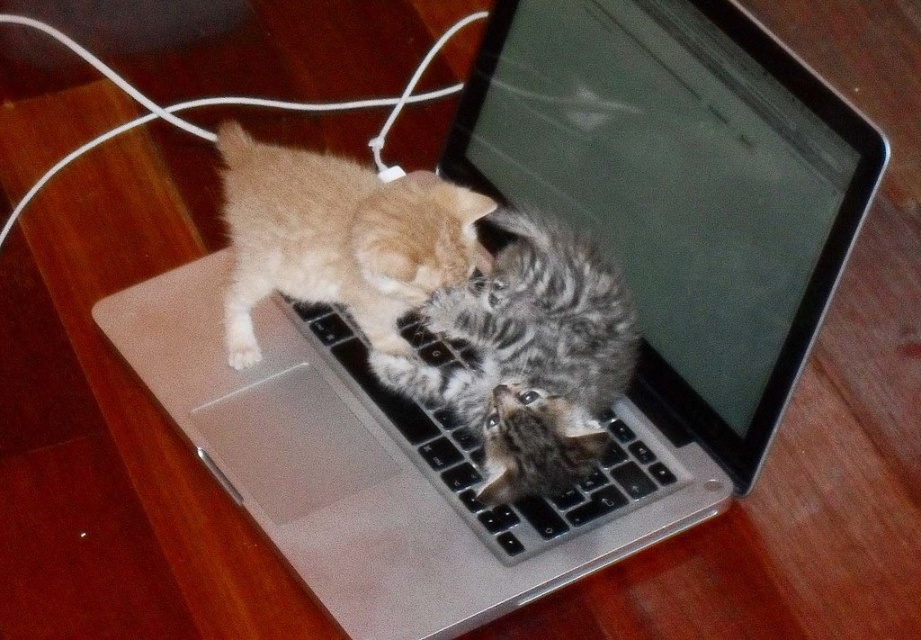
You are a photographer trying to capture a closeup shot of the gray tabby kitten at center. Based on the coordinates given in the scene description, where should you focus your camera lens to ensure the kitten is centered in the frame?

The gray tabby kitten at center is located at coordinates point (529,356), so you should focus your camera lens at that point to center the kitten in the frame.

You are a photographer trying to capture a clear shot of the tabby fur kitten at center and the black plastic keyboard at center. Since the laptop screen is reflecting light, you need to adjust your position. Which direction should you move to avoid the reflection and still keep both objects in frame?

The tabby fur kitten at center is to the left of the black plastic keyboard at center. To avoid the reflection, you should move to the right side of the laptop so that the light source is behind you, ensuring both objects remain in frame.